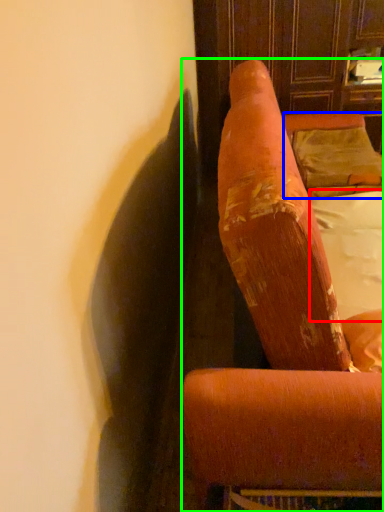
Question: Considering the real-world distances, which object is farthest from sheet (highlighted by a red box)? pillow (highlighted by a blue box) or furniture (highlighted by a green box)?

Choices:
 (A) pillow
 (B) furniture

Answer: (B)